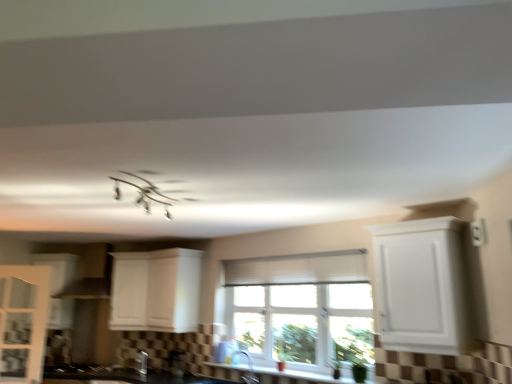
Question: Is white matte cabinet at center, which appears as the 3th cabinetry when viewed from the right, thinner than black matte gas stove at lower left?

Choices:
 (A) no
 (B) yes

Answer: (B)

Question: From the image's perspective, is white matte cabinet at center, which appears as the 3th cabinetry when viewed from the right, located beneath black matte gas stove at lower left?

Choices:
 (A) yes
 (B) no

Answer: (B)

Question: From a real-world perspective, does white matte cabinet at center, the third cabinetry when ordered from left to right, stand above black matte gas stove at lower left?

Choices:
 (A) yes
 (B) no

Answer: (A)

Question: Is white matte cabinet at center, which appears as the 3th cabinetry when viewed from the right, to the left of black matte gas stove at lower left from the viewer's perspective?

Choices:
 (A) no
 (B) yes

Answer: (A)

Question: Can black matte gas stove at lower left be found inside white matte cabinet at center, which appears as the 3th cabinetry when viewed from the right?

Choices:
 (A) yes
 (B) no

Answer: (B)

Question: From the image's perspective, is white matte cabinet at center, arranged as the 2th cabinetry when viewed from the right, positioned above or below white pleated blind at center?

Choices:
 (A) above
 (B) below

Answer: (B)

Question: Looking at their shapes, would you say white matte cabinet at center, arranged as the 2th cabinetry when viewed from the right, is wider or thinner than white pleated blind at center?

Choices:
 (A) thin
 (B) wide

Answer: (B)

Question: Is white matte cabinet at center, arranged as the 2th cabinetry when viewed from the right, inside the boundaries of white pleated blind at center, or outside?

Choices:
 (A) outside
 (B) inside

Answer: (A)

Question: Based on their sizes in the image, would you say white matte cabinet at center, arranged as the 2th cabinetry when viewed from the right, is bigger or smaller than white pleated blind at center?

Choices:
 (A) small
 (B) big

Answer: (B)

Question: From their relative heights in the image, would you say white ceramic window sill at lower center is taller or shorter than white glossy cabinet at left, which is the fifth cabinetry in right-to-left order?

Choices:
 (A) tall
 (B) short

Answer: (B)

Question: From a real-world perspective, is white ceramic window sill at lower center above or below white glossy cabinet at left, the 1th cabinetry when ordered from left to right?

Choices:
 (A) above
 (B) below

Answer: (B)

Question: Is white ceramic window sill at lower center inside the boundaries of white glossy cabinet at left, the 1th cabinetry when ordered from left to right, or outside?

Choices:
 (A) outside
 (B) inside

Answer: (A)

Question: Considering the positions of point (206, 365) and point (57, 322), is point (206, 365) closer or farther from the camera than point (57, 322)?

Choices:
 (A) closer
 (B) farther

Answer: (A)

Question: From the image's perspective, is metallic stainless steel toaster at lower center, the second appliance when ordered from left to right, located above or below white matte cabinet at center, arranged as the 2th cabinetry when viewed from the right?

Choices:
 (A) above
 (B) below

Answer: (B)

Question: Relative to white matte cabinet at center, the fourth cabinetry from the left, is metallic stainless steel toaster at lower center, the second appliance when ordered from left to right, in front or behind?

Choices:
 (A) front
 (B) behind

Answer: (B)